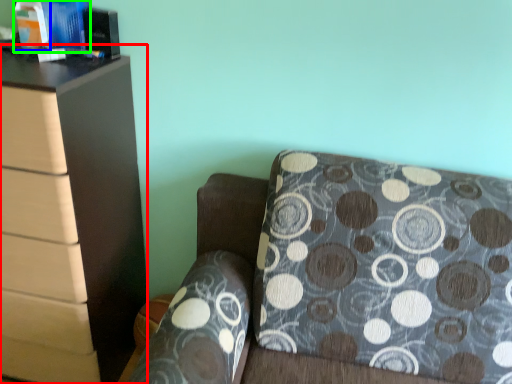
Question: Which object is positioned farthest from chest of drawers (highlighted by a red box)? Select from book (highlighted by a blue box) and book (highlighted by a green box).

Choices:
 (A) book
 (B) book

Answer: (A)